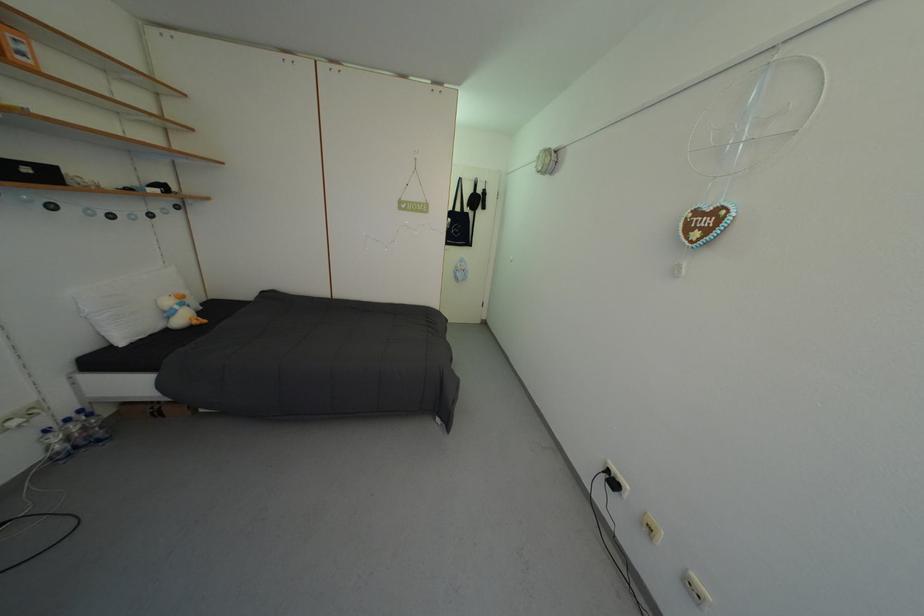
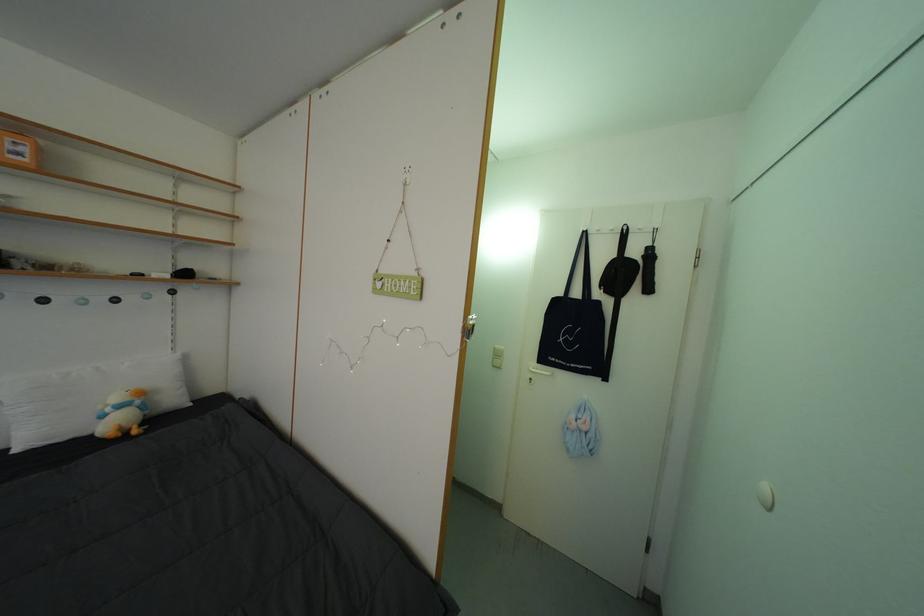
Where in the second image is the point corresponding to point (467, 215) from the first image?

(586, 300)